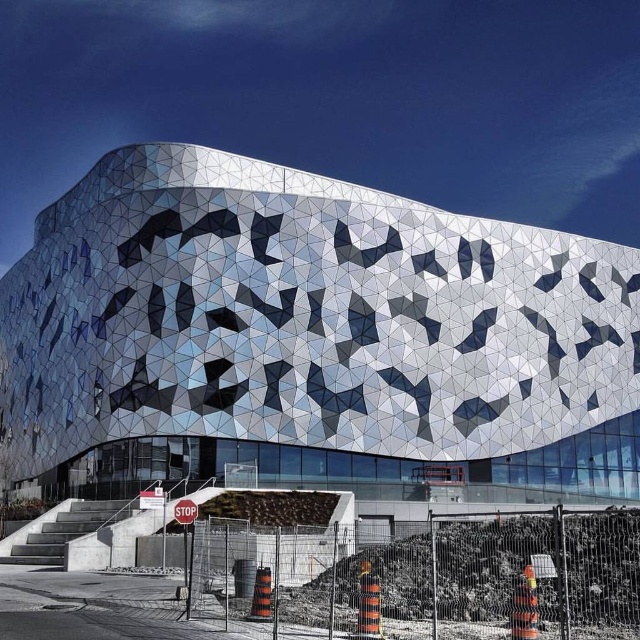
Question: Can you confirm if orange traffic cone at lower center is positioned to the left of red plastic stop sign at center?

Choices:
 (A) yes
 (B) no

Answer: (B)

Question: Estimate the real-world distances between objects in this image. Which object is farther from the metallic geometric facade at center?

Choices:
 (A) orange traffic cone at lower center
 (B) red plastic stop sign at center

Answer: (B)

Question: Does metallic geometric facade at center have a greater width compared to red plastic stop sign at center?

Choices:
 (A) no
 (B) yes

Answer: (B)

Question: Which object appears farthest from the camera in this image?

Choices:
 (A) metallic geometric facade at center
 (B) red plastic stop sign at center
 (C) orange traffic cone at lower center

Answer: (A)

Question: Which point appears closest to the camera in this image?

Choices:
 (A) (176, 516)
 (B) (45, 596)

Answer: (B)

Question: Is metallic geometric facade at center positioned at the back of orange traffic cone at lower center?

Choices:
 (A) no
 (B) yes

Answer: (B)